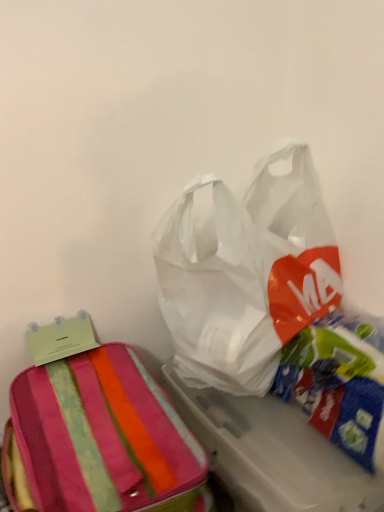
Question: Looking at their shapes, would you say striped fabric suitcase at left is wider or thinner than transparent plastic bag at upper right?

Choices:
 (A) wide
 (B) thin

Answer: (A)

Question: From their relative heights in the image, would you say striped fabric suitcase at left is taller or shorter than transparent plastic bag at upper right?

Choices:
 (A) tall
 (B) short

Answer: (B)

Question: From a real-world perspective, is striped fabric suitcase at left above or below transparent plastic bag at upper right?

Choices:
 (A) below
 (B) above

Answer: (A)

Question: Considering the positions of transparent plastic bag at upper right and striped fabric suitcase at left in the image, is transparent plastic bag at upper right bigger or smaller than striped fabric suitcase at left?

Choices:
 (A) small
 (B) big

Answer: (B)

Question: In terms of height, does transparent plastic bag at upper right look taller or shorter compared to striped fabric suitcase at left?

Choices:
 (A) short
 (B) tall

Answer: (B)

Question: Considering the relative positions of transparent plastic bag at upper right and striped fabric suitcase at left in the image provided, is transparent plastic bag at upper right to the left or to the right of striped fabric suitcase at left?

Choices:
 (A) right
 (B) left

Answer: (A)

Question: Is transparent plastic bag at upper right situated inside striped fabric suitcase at left or outside?

Choices:
 (A) outside
 (B) inside

Answer: (A)